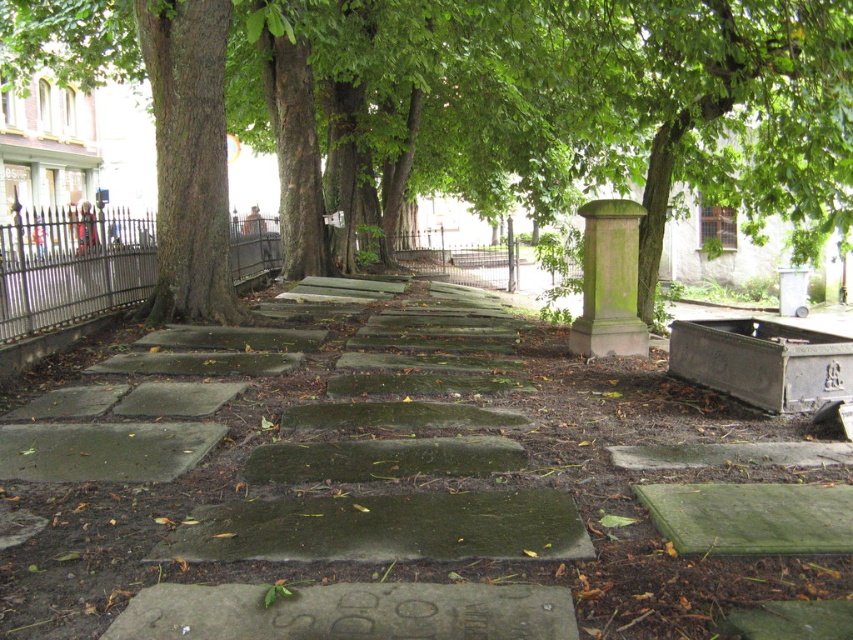
Does green mossy stone at center have a greater height compared to iron/grey metal fence at left?

In fact, green mossy stone at center may be shorter than iron/grey metal fence at left.

Is the position of green mossy stone at center less distant than that of iron/grey metal fence at left?

Yes.

Does point (727, 481) lie behind point (251, 257)?

No.

The image size is (853, 640). What are the coordinates of `green mossy stone at center` in the screenshot? It's located at 392,492.

How far apart are green mossy tree at center and green mossy stone pillar at center-right?

6.92 meters

Is green mossy tree at center shorter than green mossy stone pillar at center-right?

No, green mossy tree at center is not shorter than green mossy stone pillar at center-right.

Find the location of a particular element. green mossy tree at center is located at coordinates (468, 106).

Is green mossy tree at center taller than iron/grey metal fence at left?

Correct, green mossy tree at center is much taller as iron/grey metal fence at left.

Does green mossy tree at center appear on the left side of iron/grey metal fence at left?

Incorrect, green mossy tree at center is not on the left side of iron/grey metal fence at left.

This screenshot has width=853, height=640. What do you see at coordinates (468, 106) in the screenshot?
I see `green mossy tree at center` at bounding box center [468, 106].

This screenshot has width=853, height=640. I want to click on green mossy tree at center, so click(468, 106).